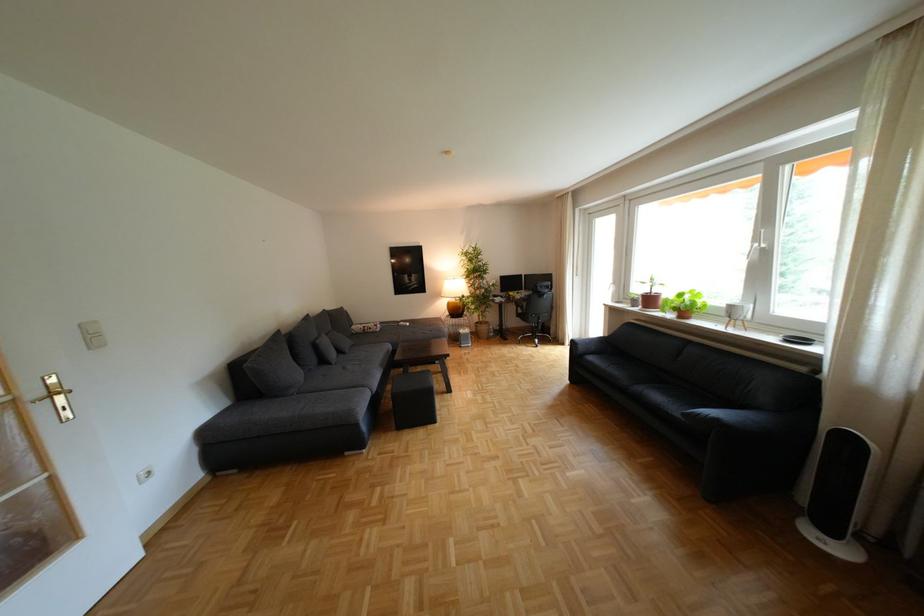
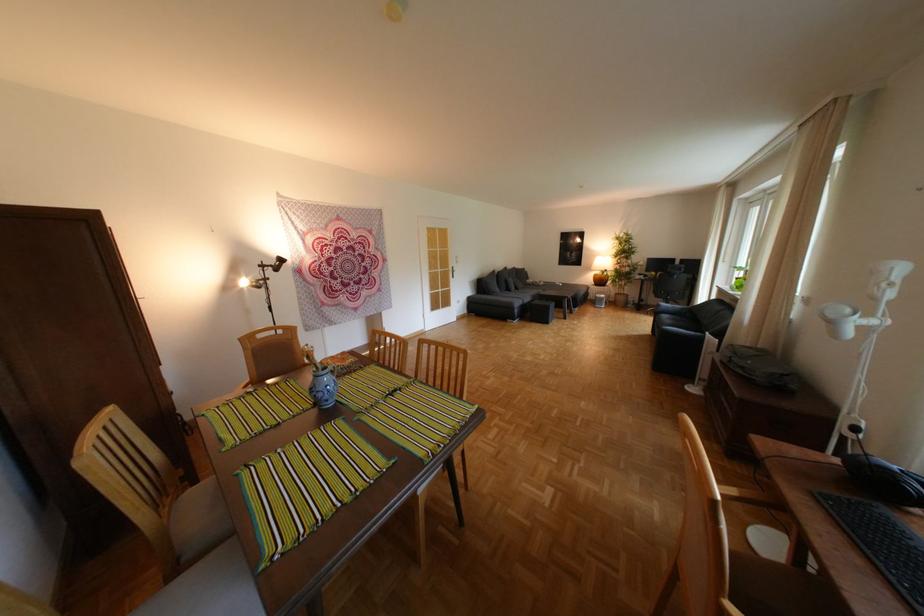
Find the pixel in the second image that matches the point at 451,294 in the first image.

(602, 268)